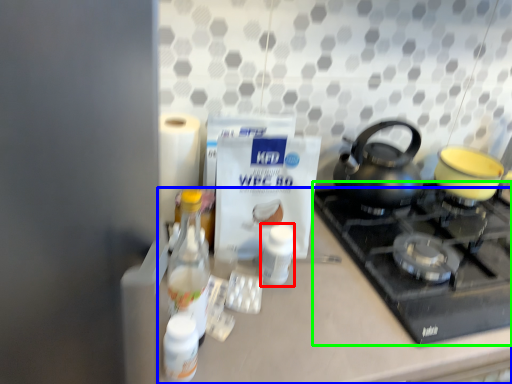
Question: Estimate the real-world distances between objects in this image. Which object is closer to bottle (highlighted by a red box), counter (highlighted by a blue box) or gas stove (highlighted by a green box)?

Choices:
 (A) counter
 (B) gas stove

Answer: (A)